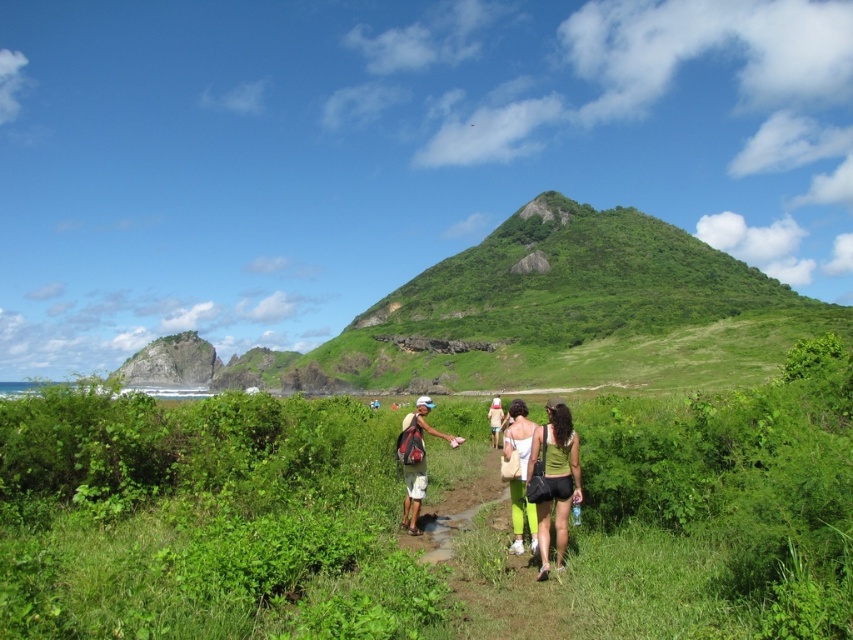
Question: Is the position of matte green pants at center less distant than that of matte khaki shorts at center?

Choices:
 (A) yes
 (B) no

Answer: (A)

Question: Can you confirm if matte green pants at center is bigger than matte khaki shorts at center?

Choices:
 (A) no
 (B) yes

Answer: (A)

Question: Which point is closer to the camera?

Choices:
 (A) (563, 484)
 (B) (740, 529)
 (C) (521, 429)

Answer: (B)

Question: Does green grassy hill at upper center have a smaller size compared to matte green pants at center?

Choices:
 (A) no
 (B) yes

Answer: (A)

Question: Which object is closer to the camera taking this photo?

Choices:
 (A) matte khaki shorts at center
 (B) green fabric dress at center
 (C) green leafy vegetation at center
 (D) matte green pants at center

Answer: (C)

Question: Which of these objects is positioned closest to the green fabric dress at center?

Choices:
 (A) matte khaki shorts at center
 (B) matte green pants at center
 (C) green grassy hill at upper center

Answer: (B)